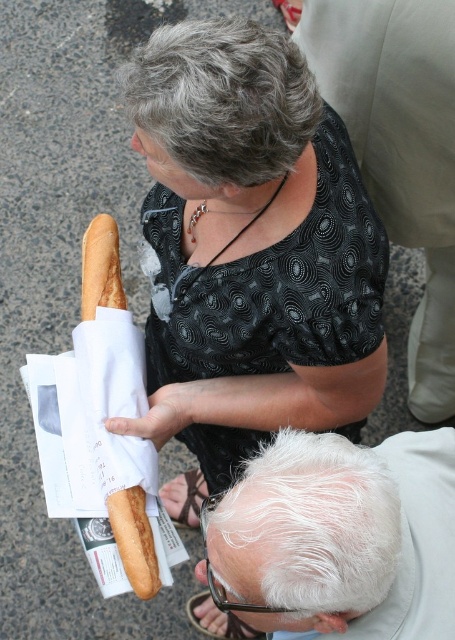
Question: Which object is positioned farthest from the white hair at lower center?

Choices:
 (A) golden brown bread at left
 (B) matte black blouse at upper center

Answer: (A)

Question: Among these points, which one is farthest from the camera?

Choices:
 (A) (170, 276)
 (B) (151, 580)

Answer: (A)

Question: Does white hair at lower center have a greater width compared to golden brown bread at left?

Choices:
 (A) yes
 (B) no

Answer: (A)

Question: Is white hair at lower center above golden brown bread at left?

Choices:
 (A) no
 (B) yes

Answer: (A)

Question: Which of the following is the farthest from the observer?

Choices:
 (A) matte black blouse at upper center
 (B) white hair at lower center

Answer: (A)

Question: Does matte black blouse at upper center appear under white hair at lower center?

Choices:
 (A) yes
 (B) no

Answer: (B)